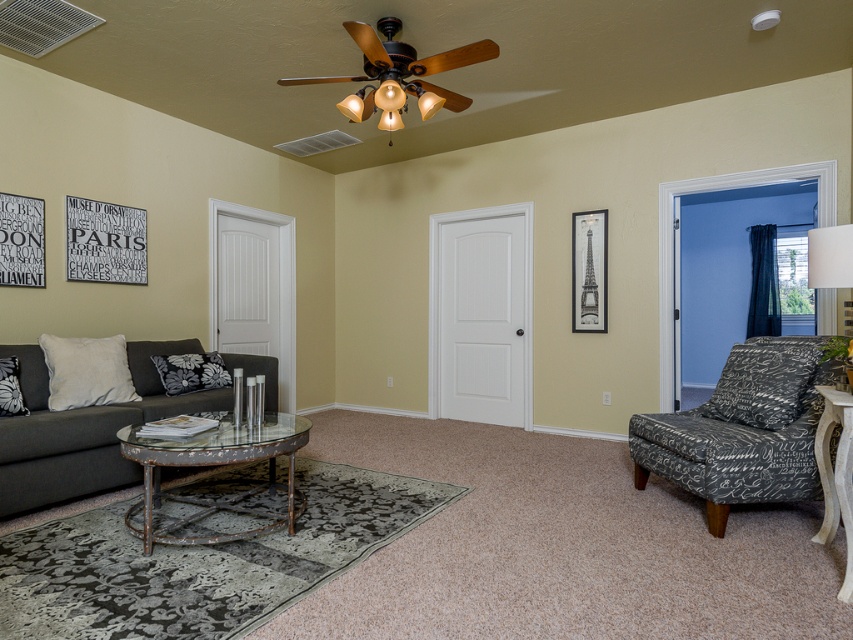
You are standing in the living room and want to reach the matte brown ceiling fan at upper center. If your maximum reach is 1.8 meters, can you touch it without any tools?

The matte brown ceiling fan at upper center is 3.18 meters away from camera. Since your maximum reach is only 1.8 meters, you cannot touch it without any tools.

You are standing at the entrance of the living room and want to place a small plant on the white wood side table at lower right. Based on the coordinates provided, can you determine if the table is positioned near the entrance or the opposite wall?

The white wood side table at lower right is located at coordinates point (836, 476), which places it near the entrance of the living room. Therefore, you can place the small plant there.

You are standing in the living room and want to move from the dark gray fabric couch at left to the white fabric lampshade at upper right. Which object will you encounter first as you walk towards the lampshade?

You will encounter the dark gray fabric couch at left first because it is closer to you than the white fabric lampshade at upper right, which is further away.